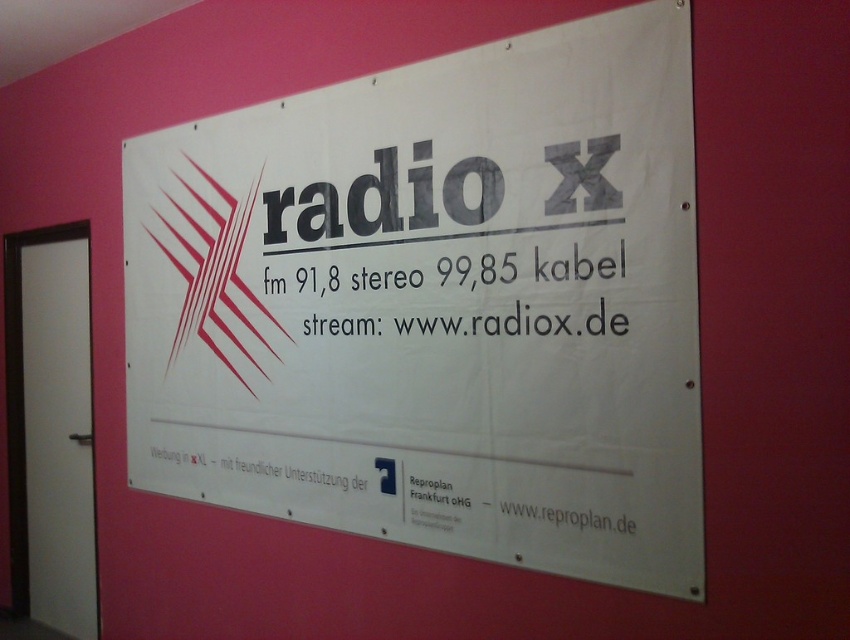
Is point (502, 212) behind point (599, 518)?

Yes.

Looking at this image, is the position of white paper text at center more distant than that of white text at center?

No, it is not.

Find the location of a particular element. white paper text at center is located at coordinates (474, 307).

This screenshot has width=850, height=640. In order to click on white paper text at center in this screenshot , I will do `click(474, 307)`.

Can you confirm if white paper poster at center is positioned above white paper text at center?

Actually, white paper poster at center is below white paper text at center.

Between point (697, 403) and point (578, 321), which one is positioned in front?

Positioned in front is point (697, 403).

Image resolution: width=850 pixels, height=640 pixels. Find the location of `white paper poster at center`. white paper poster at center is located at coordinates (435, 304).

Who is shorter, white paper poster at center or white text at center?

Standing shorter between the two is white text at center.

Locate an element on the screen. This screenshot has height=640, width=850. white paper poster at center is located at coordinates (435, 304).

Where is `white paper poster at center`? This screenshot has height=640, width=850. white paper poster at center is located at coordinates (435, 304).